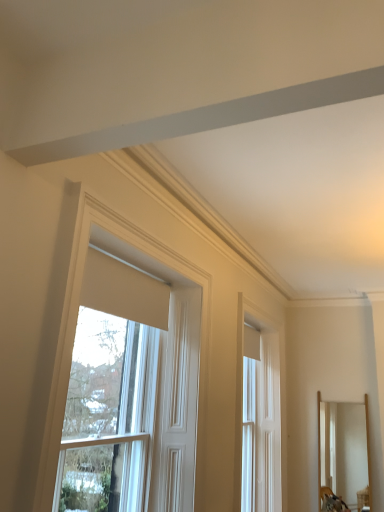
Question: Would you say wooden mirror at right is to the left or to the right of white glossy door at center, the 2th window positioned from the left, in the picture?

Choices:
 (A) left
 (B) right

Answer: (B)

Question: From a real-world perspective, is wooden mirror at right physically located above or below white glossy door at center, the 2th window positioned from the left?

Choices:
 (A) below
 (B) above

Answer: (A)

Question: Which object is positioned farthest from the white matte window at upper center, the second window positioned from the right?

Choices:
 (A) wooden mirror at right
 (B) white glossy door at center, which is the first window from back to front

Answer: (A)

Question: Which object is positioned farthest from the wooden mirror at right?

Choices:
 (A) white matte window at upper center, the second window positioned from the right
 (B) white glossy door at center, which is the first window from back to front

Answer: (A)